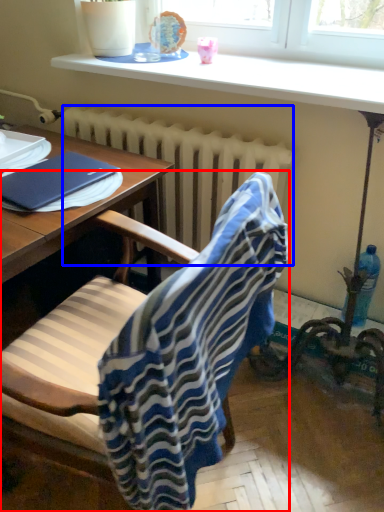
Question: Among these objects, which one is nearest to the camera, chair (highlighted by a red box) or radiator (highlighted by a blue box)?

Choices:
 (A) chair
 (B) radiator

Answer: (A)